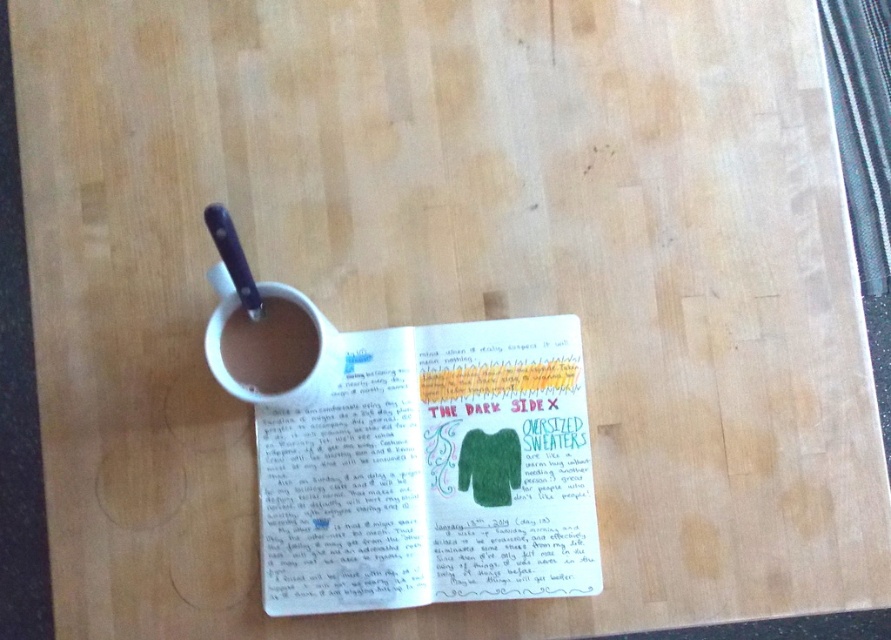
Question: Can you confirm if white paper at center is positioned above brown matte mug at upper center?

Choices:
 (A) no
 (B) yes

Answer: (A)

Question: Which point appears closest to the camera in this image?

Choices:
 (A) (291, 301)
 (B) (276, 468)

Answer: (A)

Question: Is brown matte mug at upper center thinner than matte white mug at upper left?

Choices:
 (A) no
 (B) yes

Answer: (B)

Question: Which point is closer to the camera?

Choices:
 (A) brown matte mug at upper center
 (B) matte white mug at upper left

Answer: (B)

Question: Does white paper at center appear over matte white mug at upper left?

Choices:
 (A) no
 (B) yes

Answer: (A)

Question: Which object is farther from the camera taking this photo?

Choices:
 (A) brown matte mug at upper center
 (B) matte white mug at upper left

Answer: (A)